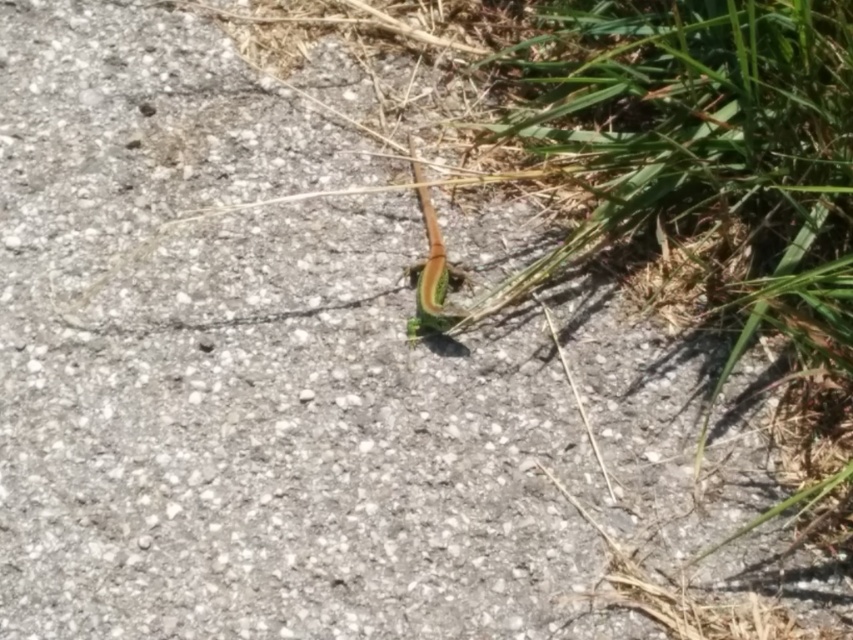
Is the position of green leafy grass at center more distant than that of green matte grasshopper at center?

No.

Is green leafy grass at center smaller than green matte grasshopper at center?

No, green leafy grass at center is not smaller than green matte grasshopper at center.

Which is behind, point (602, 1) or point (416, 332)?

The point (602, 1) is more distant.

Where is `green leafy grass at center`? green leafy grass at center is located at coordinates (705, 145).